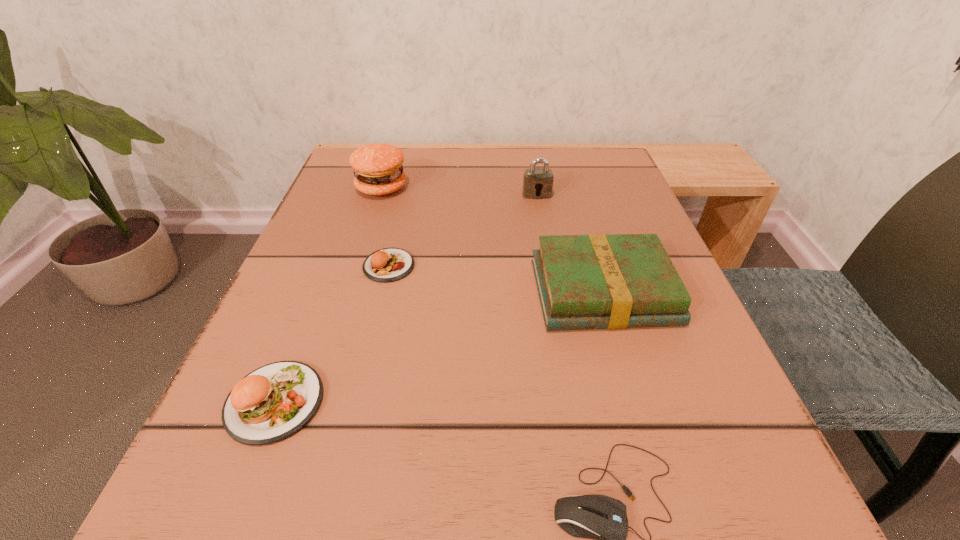
Image resolution: width=960 pixels, height=540 pixels. I want to click on blank space at the near right corner of the desktop, so pos(715,524).

The height and width of the screenshot is (540, 960). Find the location of `vacant area that lies between the book and the tallest patty (food)`. vacant area that lies between the book and the tallest patty (food) is located at coordinates (492, 240).

Locate an element on the screen. Image resolution: width=960 pixels, height=540 pixels. vacant area that lies between the shortest patty (food) and the padlock is located at coordinates [x=463, y=230].

Identify the location of vacant area that lies between the shortest patty (food) and the tallest patty (food). (385, 227).

Image resolution: width=960 pixels, height=540 pixels. Find the location of `blank region between the shortest patty (food) and the padlock`. blank region between the shortest patty (food) and the padlock is located at coordinates (463, 230).

What are the coordinates of `vacant region between the tallest patty (food) and the shortest patty (food)` in the screenshot? It's located at (385, 227).

Where is `free space between the third tallest object and the second nearest patty (food)`? free space between the third tallest object and the second nearest patty (food) is located at coordinates (495, 279).

The height and width of the screenshot is (540, 960). Find the location of `vacant area that lies between the second tallest patty (food) and the fourth shortest object`. vacant area that lies between the second tallest patty (food) and the fourth shortest object is located at coordinates (439, 347).

At what (x,y) coordinates should I click in order to perform the action: click on free space between the book and the shortest patty (food). Please return your answer as a coordinate pair (x, y). This screenshot has width=960, height=540. Looking at the image, I should click on (495, 279).

Locate which object is the fifth closest to the second tallest patty (food). Please provide its 2D coordinates. Your answer should be formatted as a tuple, i.e. [(x, y)], where the tuple contains the x and y coordinates of a point satisfying the conditions above.

[(536, 181)]